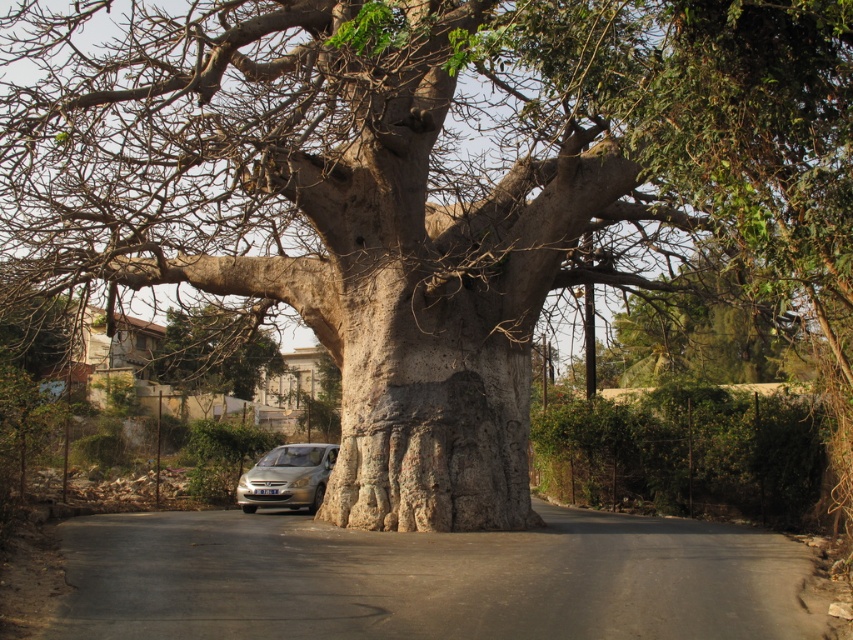
You are standing at the camera position and want to take a photo of the green leafy tree at center. The camera has a maximum zoom range of 50 feet. Can you capture the entire tree in one shot without moving closer?

The distance between you and the green leafy tree at center is 57.50 feet, which exceeds the camera maximum zoom range of 50 feet. Therefore, you cannot capture the entire tree in one shot without moving closer.

You are a driver trying to park your car on the road near the green leafy tree at center. Considering the size of the silver metallic car at center, will there be enough space to park without touching the tree?

The green leafy tree at center has a larger size compared to the silver metallic car at center. Since the tree is bigger, there might be enough space around it for the car to park without touching it, but the exact available space depends on the tree trunk and branches. However, based on the size comparison alone, the car should fit as it is smaller than the tree.